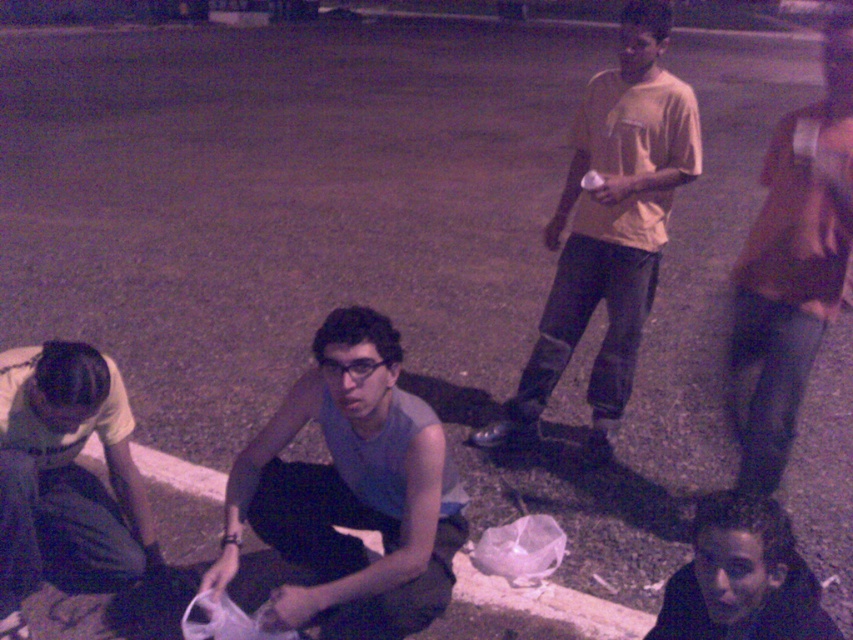
Can you confirm if light yellow t-shirt at upper right is bigger than brown leather jacket at right?

No.

Does light yellow t-shirt at upper right have a lesser width compared to brown leather jacket at right?

Yes, light yellow t-shirt at upper right is thinner than brown leather jacket at right.

Is point (624, 202) farther from camera compared to point (776, 339)?

That is True.

The height and width of the screenshot is (640, 853). I want to click on light yellow t-shirt at upper right, so click(x=608, y=228).

Consider the image. Between matte gray tank top at center and light gray fabric pants at lower left, which one is positioned higher?

Positioned higher is matte gray tank top at center.

Can you confirm if matte gray tank top at center is positioned above light gray fabric pants at lower left?

Yes, matte gray tank top at center is above light gray fabric pants at lower left.

Who is more forward, (425, 506) or (39, 544)?

Point (425, 506) is in front.

The width and height of the screenshot is (853, 640). Identify the location of matte gray tank top at center. (350, 484).

Does matte gray tank top at center come behind white plastic bag at lower center?

That is False.

Is matte gray tank top at center to the left of white plastic bag at lower center from the viewer's perspective?

In fact, matte gray tank top at center is to the right of white plastic bag at lower center.

Is point (404, 413) less distant than point (566, 602)?

Yes, it is.

The image size is (853, 640). Find the location of `matte gray tank top at center`. matte gray tank top at center is located at coordinates (350, 484).